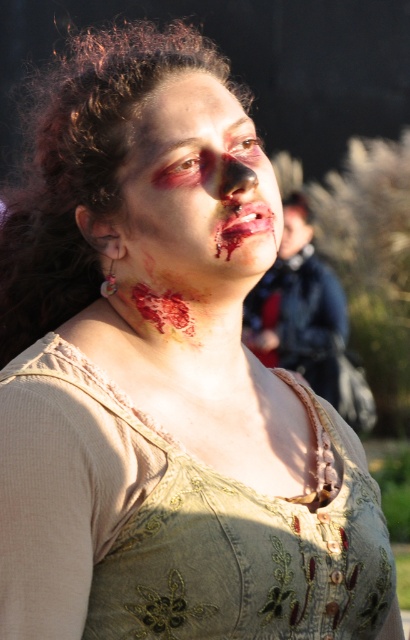
Can you confirm if dark curly hair at upper center is positioned below matte flesh-colored nose at center?

Actually, dark curly hair at upper center is above matte flesh-colored nose at center.

Which is more to the left, dark curly hair at upper center or matte flesh-colored nose at center?

dark curly hair at upper center is more to the left.

What do you see at coordinates (82, 166) in the screenshot? This screenshot has height=640, width=410. I see `dark curly hair at upper center` at bounding box center [82, 166].

Locate an element on the screen. This screenshot has width=410, height=640. dark curly hair at upper center is located at coordinates (82, 166).

Between green embroidered dress at center and blood-stained skin at center, which one has less height?

blood-stained skin at center

Describe the element at coordinates (170, 525) in the screenshot. The image size is (410, 640). I see `green embroidered dress at center` at that location.

Is point (289, 586) farther from camera compared to point (216, 99)?

That is False.

Where is `green embroidered dress at center`? The image size is (410, 640). green embroidered dress at center is located at coordinates (170, 525).

Who is taller, green embroidered dress at center or matte flesh-colored nose at center?

With more height is green embroidered dress at center.

Based on the photo, how distant is green embroidered dress at center from matte flesh-colored nose at center?

green embroidered dress at center and matte flesh-colored nose at center are 71.21 centimeters apart.

Is point (61, 412) more distant than point (223, 154)?

No, (61, 412) is in front of (223, 154).

You are a GUI agent. You are given a task and a screenshot of the screen. Output one action in this format:
    pyautogui.click(x=<x>, y=<y>)
    Task: Click on the green embroidered dress at center
    Image resolution: width=410 pixels, height=640 pixels.
    Given the screenshot: What is the action you would take?
    pyautogui.click(x=170, y=525)